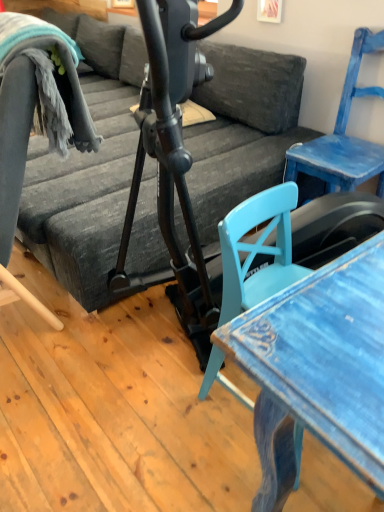
Question: Should I look upward or downward to see blue painted wood chair at right?

Choices:
 (A) down
 (B) up

Answer: (B)

Question: Would you say blue painted wood chair at right is part of dark gray fabric couch at center's contents?

Choices:
 (A) yes
 (B) no

Answer: (B)

Question: From the image's perspective, is dark gray fabric couch at center beneath blue painted wood chair at right?

Choices:
 (A) yes
 (B) no

Answer: (B)

Question: Is dark gray fabric couch at center wider than blue painted wood chair at right?

Choices:
 (A) yes
 (B) no

Answer: (A)

Question: Is dark gray fabric couch at center looking in the opposite direction of blue painted wood chair at right?

Choices:
 (A) no
 (B) yes

Answer: (A)

Question: Can you confirm if dark gray fabric couch at center is positioned to the left of blue painted wood chair at right?

Choices:
 (A) no
 (B) yes

Answer: (B)

Question: Is the depth of dark gray fabric couch at center less than that of blue painted wood chair at right?

Choices:
 (A) yes
 (B) no

Answer: (A)

Question: Is blue painted wood chair at right not close to dark gray fabric couch at center?

Choices:
 (A) no
 (B) yes

Answer: (A)

Question: Can you confirm if blue painted wood chair at right is smaller than dark gray fabric couch at center?

Choices:
 (A) yes
 (B) no

Answer: (A)

Question: Is blue painted wood chair at right oriented away from dark gray fabric couch at center?

Choices:
 (A) yes
 (B) no

Answer: (B)

Question: Can you confirm if blue painted wood chair at right is positioned to the left of dark gray fabric couch at center?

Choices:
 (A) no
 (B) yes

Answer: (A)

Question: From a real-world perspective, is blue painted wood chair at right physically above dark gray fabric couch at center?

Choices:
 (A) no
 (B) yes

Answer: (B)

Question: Is the depth of blue painted wood chair at right greater than that of dark gray fabric couch at center?

Choices:
 (A) no
 (B) yes

Answer: (B)

Question: Is distressed blue table at lower right positioned behind dark gray fabric couch at center?

Choices:
 (A) yes
 (B) no

Answer: (B)